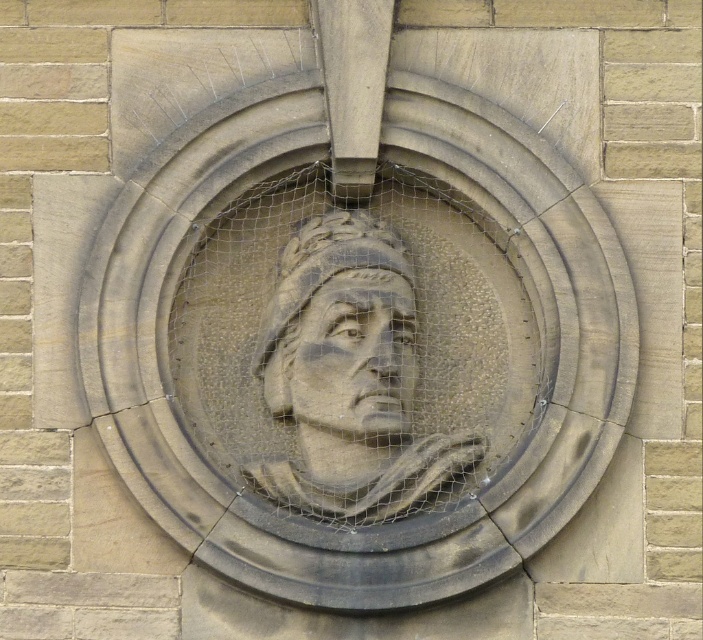
You are an art conservator examining the circular stone relief on the brick wall. You need to determine the central point of the relief to ensure proper preservation. Based on the image, where is the stone carving of man at center located?

The stone carving of man at center is located at the central point of the relief, which corresponds to the coordinates provided in the description.

You are an art conservator examining the circular stone relief. You notice two stone carvings in the image. Which one is taller, the stone carving of man at center or the stone carving head at center?

The stone carving of man at center is taller than the stone carving head at center according to the description provided.